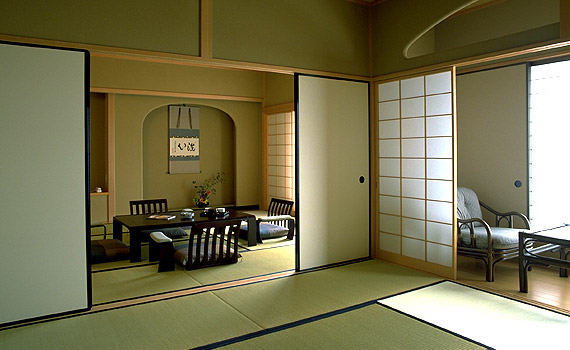
Locate an element on the screen. The image size is (570, 350). white carpet is located at coordinates (487, 315).